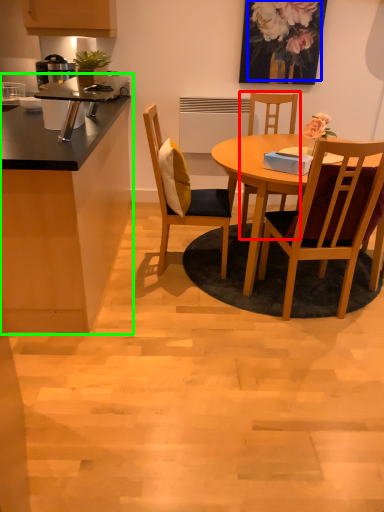
Question: Considering the real-world distances, which object is farthest from chair (highlighted by a red box)? floral arrangement (highlighted by a blue box) or cabinetry (highlighted by a green box)?

Choices:
 (A) floral arrangement
 (B) cabinetry

Answer: (B)